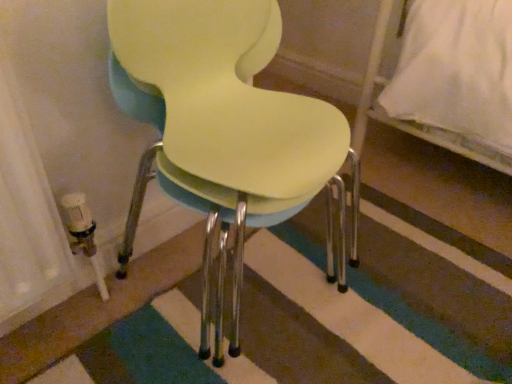
Describe the element at coordinates (225, 132) in the screenshot. This screenshot has width=512, height=384. I see `matte plastic chair at center` at that location.

Image resolution: width=512 pixels, height=384 pixels. In order to click on matte plastic chair at center in this screenshot , I will do (x=225, y=132).

Where is `matte plastic chair at center`? matte plastic chair at center is located at coordinates (225, 132).